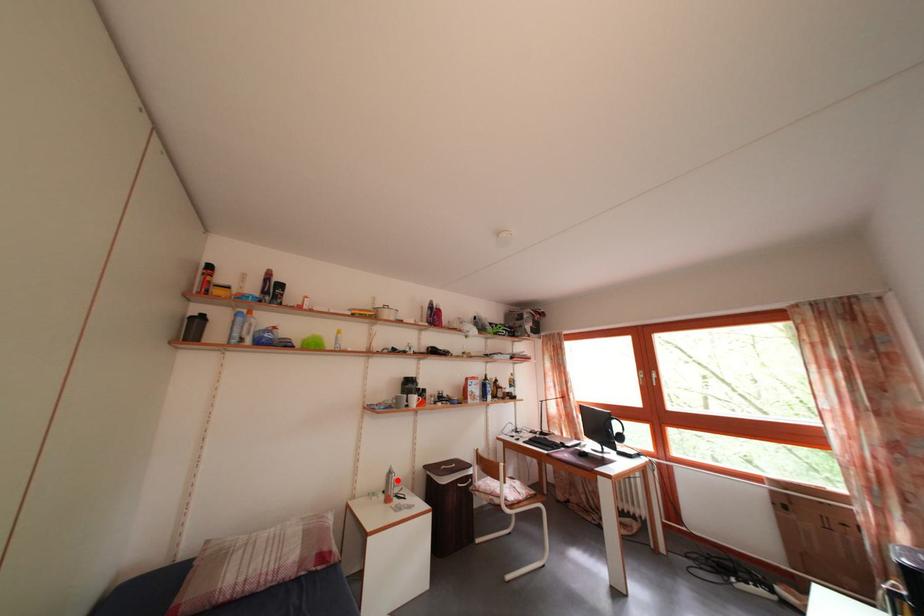
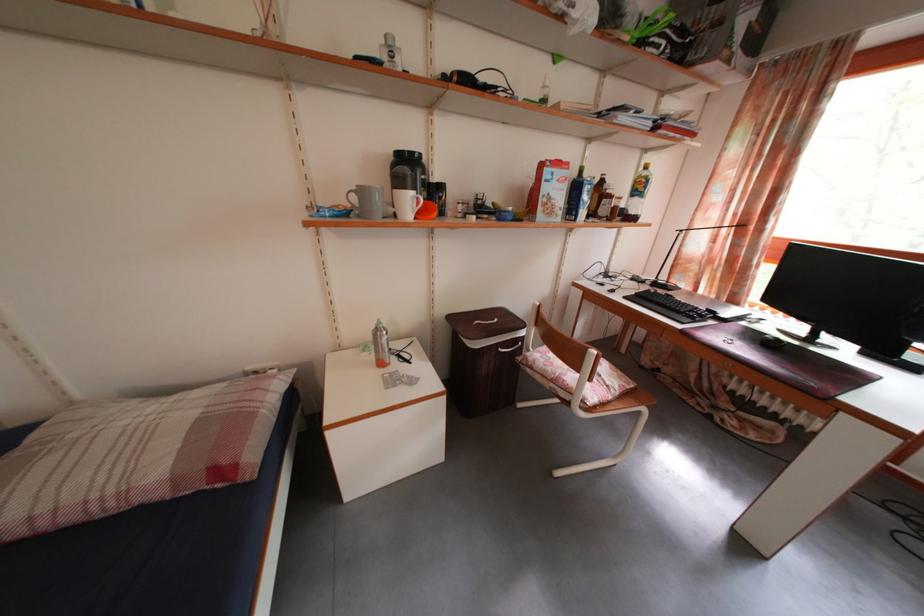
Where in the second image is the point corresponding to the highlighted location from the first image?

(384, 338)